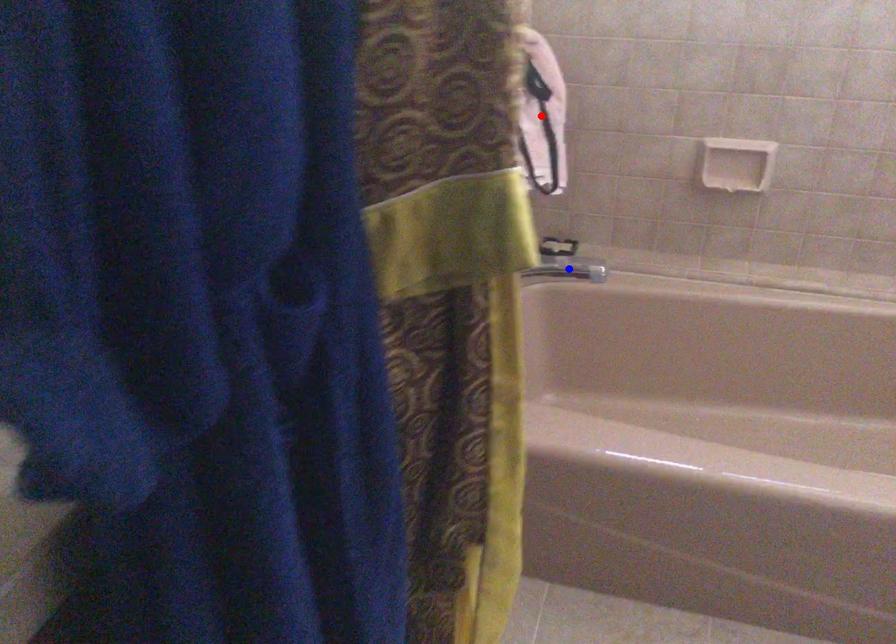
Question: In the image, two points are highlighted. Which point is nearer to the camera? Reply with the corresponding letter.

Choices:
 (A) blue point
 (B) red point

Answer: (A)